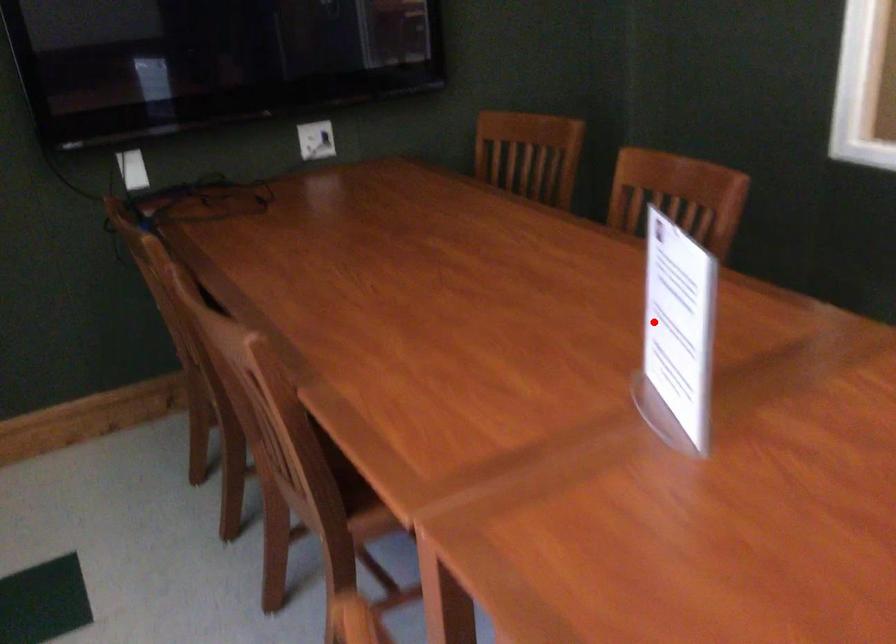
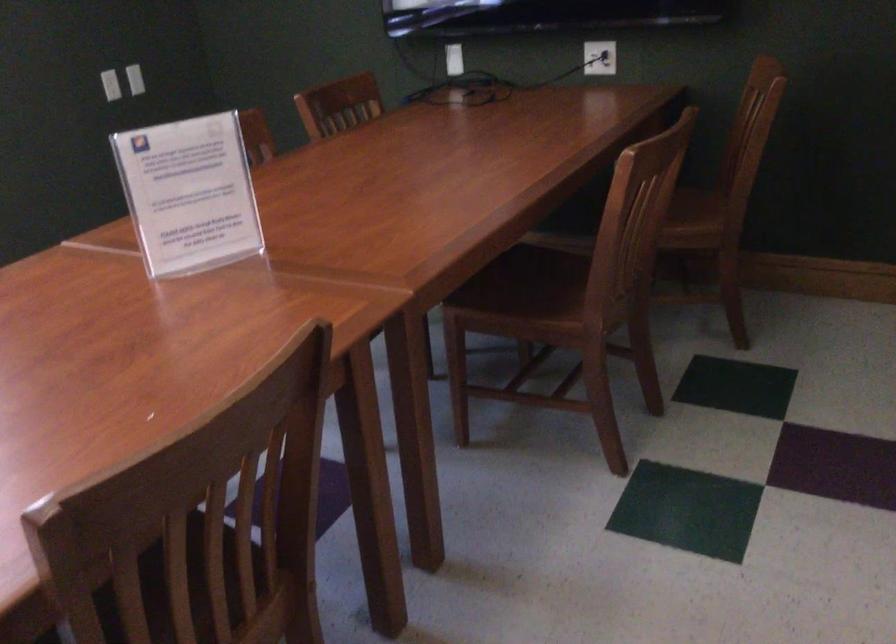
Question: I am providing you with two images of the same scene from different viewpoints. A red point is shown in image1. For the corresponding object point in image2, is it positioned nearer or farther from the camera?

Choices:
 (A) Nearer
 (B) Farther

Answer: (B)